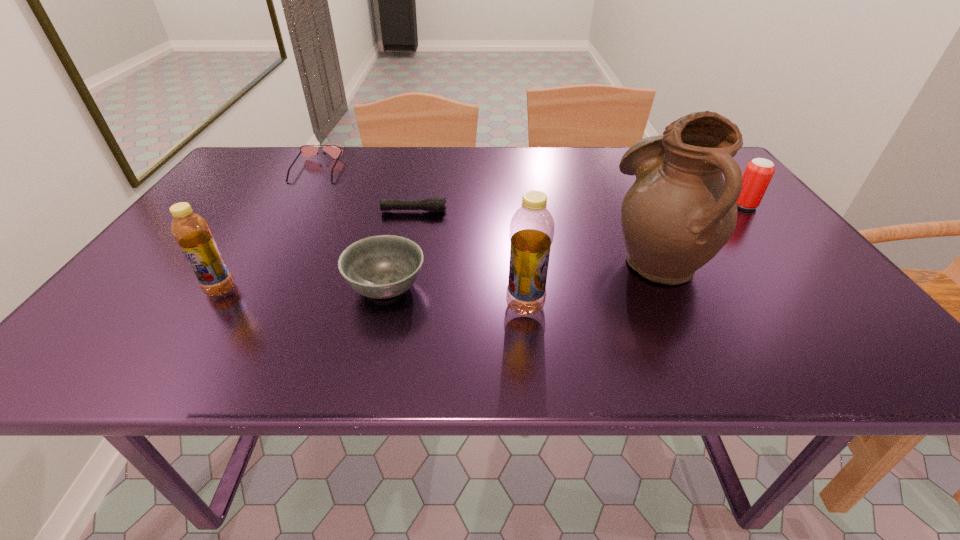
You are a GUI agent. You are given a task and a screenshot of the screen. Output one action in this format:
    pyautogui.click(x=<x>, y=<y>)
    Task: Click on the free space in the image that satisfies the following two spatial constraints: 1. on the bridge of the bowl; 2. on the right side of the sunglasses
    
    Given the screenshot: What is the action you would take?
    pyautogui.click(x=248, y=287)

Where is `vacant space that satisfies the following two spatial constraints: 1. at the lens end of the flashlight; 2. on the front side of the shorter bottle`? vacant space that satisfies the following two spatial constraints: 1. at the lens end of the flashlight; 2. on the front side of the shorter bottle is located at coordinates point(397,289).

The image size is (960, 540). In order to click on free space that satisfies the following two spatial constraints: 1. on the back side of the right bottle; 2. on the right side of the rightmost object in this screenshot , I will do `click(515, 205)`.

The image size is (960, 540). I want to click on free space that satisfies the following two spatial constraints: 1. on the bridge of the farthest object; 2. on the left side of the beer can, so click(296, 205).

This screenshot has height=540, width=960. I want to click on vacant point that satisfies the following two spatial constraints: 1. at the lens end of the shortest object; 2. on the front side of the third shortest object, so click(397, 287).

Where is `free space in the image that satisfies the following two spatial constraints: 1. on the bridge of the rightmost object; 2. on the left side of the sunglasses`? This screenshot has width=960, height=540. free space in the image that satisfies the following two spatial constraints: 1. on the bridge of the rightmost object; 2. on the left side of the sunglasses is located at coordinates (296, 205).

This screenshot has width=960, height=540. Find the location of `free spot that satisfies the following two spatial constraints: 1. on the bridge of the sunglasses; 2. on the right side of the sixth shortest object`. free spot that satisfies the following two spatial constraints: 1. on the bridge of the sunglasses; 2. on the right side of the sixth shortest object is located at coordinates (237, 306).